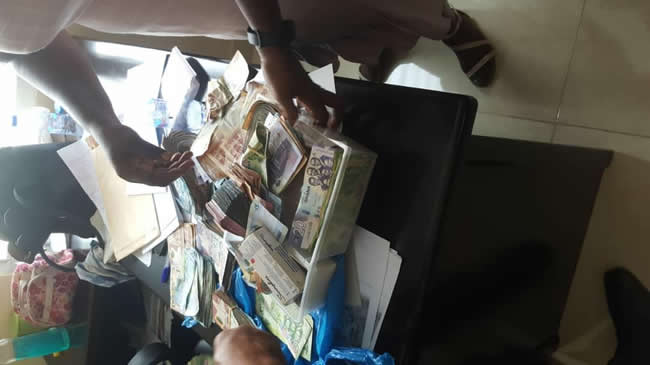
This screenshot has width=650, height=365. I want to click on bottle, so click(45, 338).